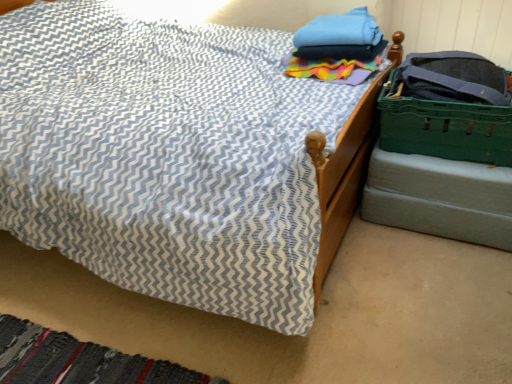
Question: From a real-world perspective, does green plastic crate at right stand above textured fabric bed at center?

Choices:
 (A) no
 (B) yes

Answer: (B)

Question: Can you confirm if green plastic crate at right is wider than textured fabric bed at center?

Choices:
 (A) no
 (B) yes

Answer: (A)

Question: Is green plastic crate at right to the left of textured fabric bed at center from the viewer's perspective?

Choices:
 (A) no
 (B) yes

Answer: (A)

Question: Can you confirm if green plastic crate at right is smaller than textured fabric bed at center?

Choices:
 (A) no
 (B) yes

Answer: (B)

Question: Would you say green plastic crate at right is outside textured fabric bed at center?

Choices:
 (A) yes
 (B) no

Answer: (A)

Question: Is green plastic crate at right facing towards textured fabric bed at center?

Choices:
 (A) no
 (B) yes

Answer: (A)

Question: From a real-world perspective, is blue cotton towels at upper right under green plastic crate at lower right?

Choices:
 (A) yes
 (B) no

Answer: (B)

Question: Is blue cotton towels at upper right positioned behind green plastic crate at lower right?

Choices:
 (A) yes
 (B) no

Answer: (A)

Question: From the image's perspective, is blue cotton towels at upper right below green plastic crate at lower right?

Choices:
 (A) yes
 (B) no

Answer: (B)

Question: Does blue cotton towels at upper right have a lesser height compared to green plastic crate at lower right?

Choices:
 (A) no
 (B) yes

Answer: (B)

Question: Is blue cotton towels at upper right turned away from green plastic crate at lower right?

Choices:
 (A) yes
 (B) no

Answer: (B)

Question: Is blue cotton towels at upper right bigger than green plastic crate at lower right?

Choices:
 (A) yes
 (B) no

Answer: (B)

Question: Considering the relative positions of green plastic crate at lower right and blue cotton towels at upper right in the image provided, is green plastic crate at lower right in front of blue cotton towels at upper right?

Choices:
 (A) no
 (B) yes

Answer: (B)